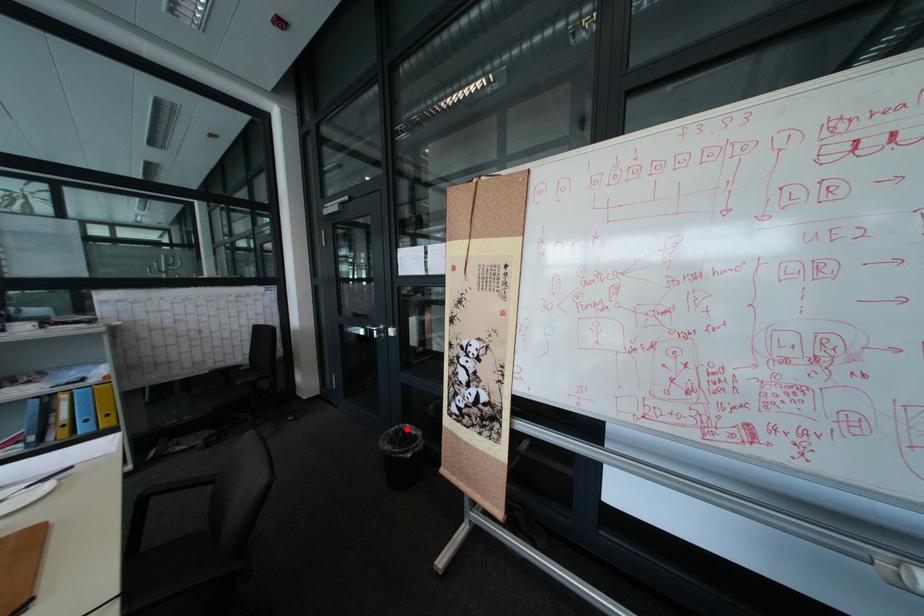
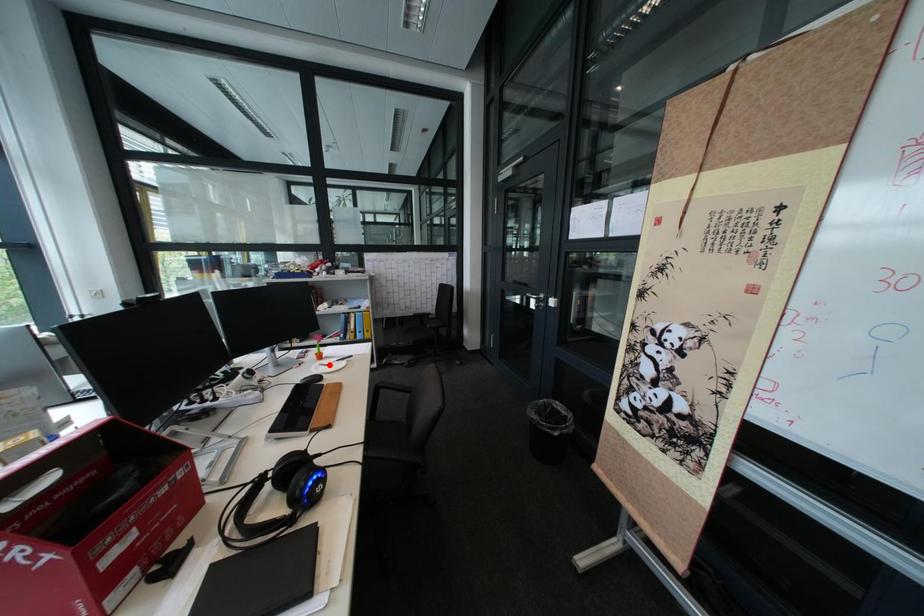
I am providing you with two images of the same scene from different viewpoints. A red point is marked on the first image and another point is marked on the second image. Is the marked point in image1 the same physical position as the marked point in image2?

No